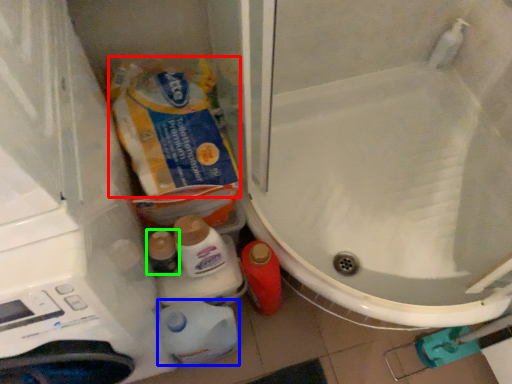
Question: Which is nearer to the product (highlighted by a red box)? cleaning product (highlighted by a blue box) or toiletry (highlighted by a green box).

Choices:
 (A) cleaning product
 (B) toiletry

Answer: (B)